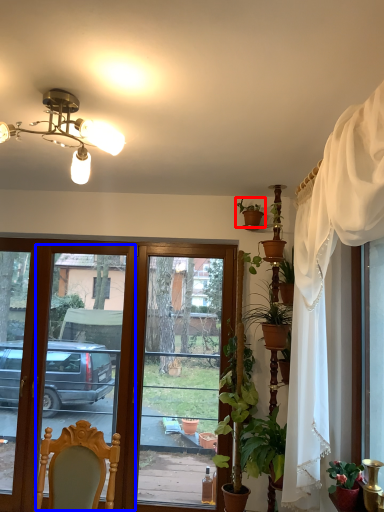
Question: Which object is closer to the camera taking this photo, houseplant (highlighted by a red box) or screen door (highlighted by a blue box)?

Choices:
 (A) houseplant
 (B) screen door

Answer: (A)